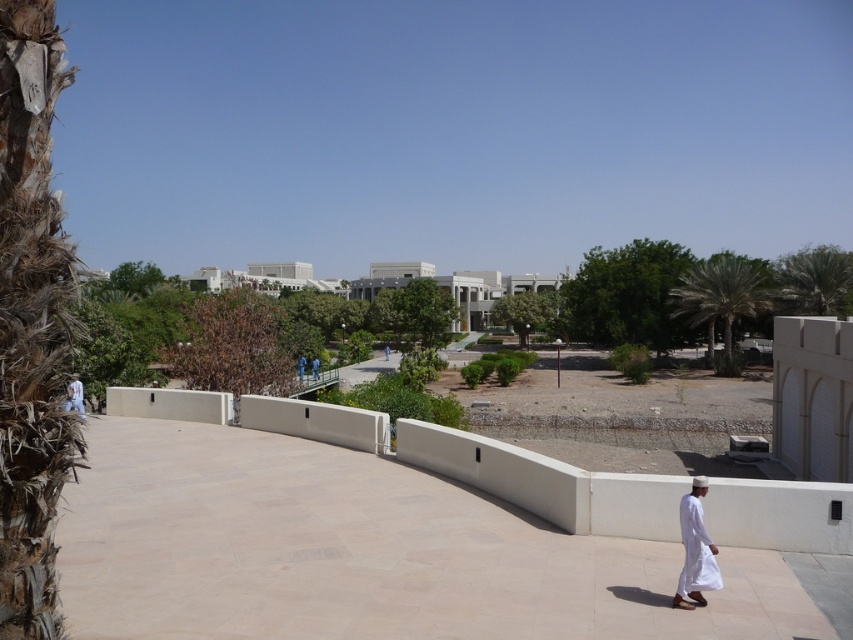
Question: Which object is closer to the camera taking this photo?

Choices:
 (A) blue fabric robe at center
 (B) dark blue shirt at center
 (C) white smooth ledge at center

Answer: (C)

Question: Can you confirm if white smooth ledge at center is smaller than blue fabric robe at center?

Choices:
 (A) yes
 (B) no

Answer: (B)

Question: Which of the following is the farthest from the observer?

Choices:
 (A) (303, 372)
 (B) (788, 298)
 (C) (689, 538)
 (D) (80, 406)

Answer: (B)

Question: Estimate the real-world distances between objects in this image. Which object is closer to the white matte robe at lower right?

Choices:
 (A) white smooth ledge at center
 (B) white cotton robe at lower left

Answer: (A)

Question: Is blue fabric robe at center wider than dark blue shirt at center?

Choices:
 (A) no
 (B) yes

Answer: (B)

Question: Is blue fabric robe at center below dark blue shirt at center?

Choices:
 (A) yes
 (B) no

Answer: (B)